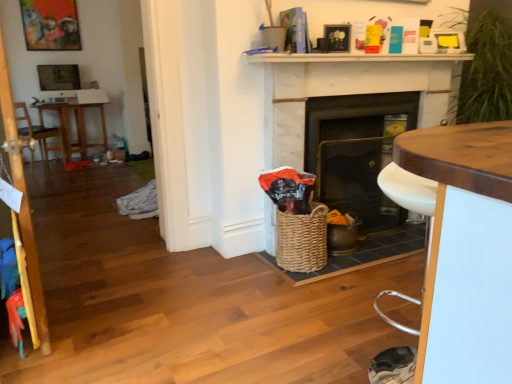
Question: Considering the relative sizes of wooden armchair at left and white marble fireplace at center, positioned as the 2th fireplace in left-to-right order, in the image provided, is wooden armchair at left wider than white marble fireplace at center, positioned as the 2th fireplace in left-to-right order,?

Choices:
 (A) no
 (B) yes

Answer: (B)

Question: From a real-world perspective, is wooden armchair at left on top of white marble fireplace at center, arranged as the 1th fireplace when viewed from the right?

Choices:
 (A) no
 (B) yes

Answer: (A)

Question: Could white marble fireplace at center, positioned as the 2th fireplace in left-to-right order, be considered to be inside wooden armchair at left?

Choices:
 (A) no
 (B) yes

Answer: (A)

Question: Would you consider wooden armchair at left to be distant from white marble fireplace at center, positioned as the 2th fireplace in left-to-right order?

Choices:
 (A) yes
 (B) no

Answer: (A)

Question: From the image's perspective, does wooden armchair at left appear lower than white marble fireplace at center, positioned as the 2th fireplace in left-to-right order?

Choices:
 (A) no
 (B) yes

Answer: (A)

Question: From the image's perspective, is wooden picture frame at upper left positioned above or below woven brown basket at center?

Choices:
 (A) below
 (B) above

Answer: (B)

Question: From a real-world perspective, is wooden picture frame at upper left positioned above or below woven brown basket at center?

Choices:
 (A) below
 (B) above

Answer: (B)

Question: Considering the positions of wooden picture frame at upper left and woven brown basket at center in the image, is wooden picture frame at upper left bigger or smaller than woven brown basket at center?

Choices:
 (A) big
 (B) small

Answer: (A)

Question: Would you say wooden picture frame at upper left is inside or outside woven brown basket at center?

Choices:
 (A) inside
 (B) outside

Answer: (B)

Question: Based on their positions, is brown wooden table at left located to the left or right of white glossy desk at center?

Choices:
 (A) right
 (B) left

Answer: (B)

Question: From their relative heights in the image, would you say brown wooden table at left is taller or shorter than white glossy desk at center?

Choices:
 (A) short
 (B) tall

Answer: (A)

Question: From the image's perspective, is brown wooden table at left located above or below white glossy desk at center?

Choices:
 (A) above
 (B) below

Answer: (A)

Question: In terms of size, does brown wooden table at left appear bigger or smaller than white glossy desk at center?

Choices:
 (A) big
 (B) small

Answer: (A)

Question: Considering the relative positions of white glossy desk at center and woven brown basket at center in the image provided, is white glossy desk at center to the left or to the right of woven brown basket at center?

Choices:
 (A) left
 (B) right

Answer: (B)

Question: Choose the correct answer: Is white glossy desk at center inside woven brown basket at center or outside it?

Choices:
 (A) inside
 (B) outside

Answer: (B)